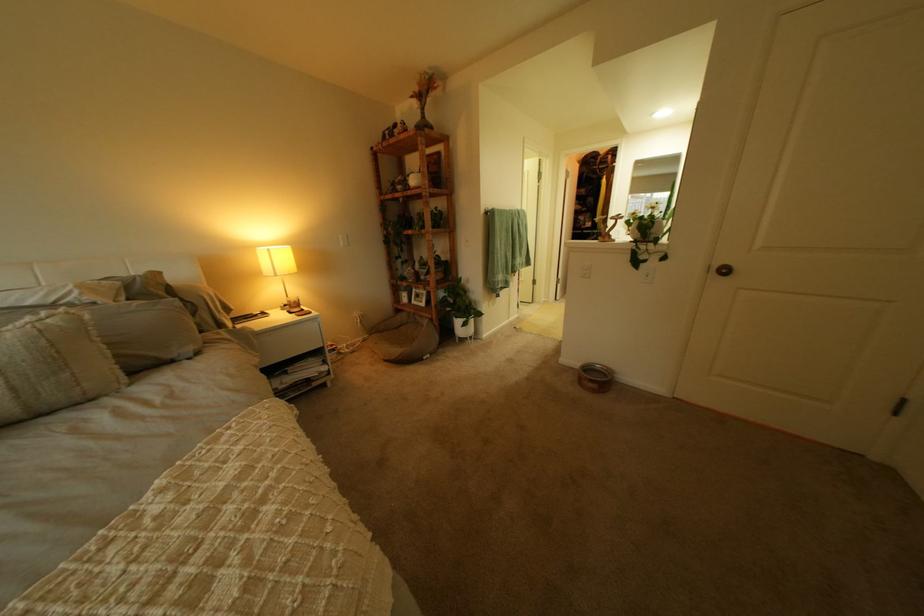
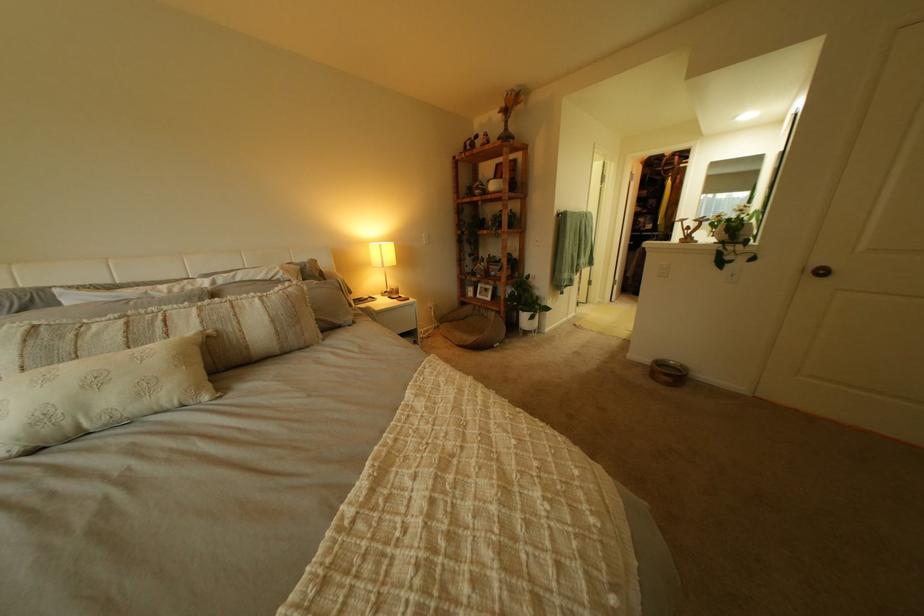
Find the pixel in the second image that matches pixel 265 248 in the first image.

(381, 244)